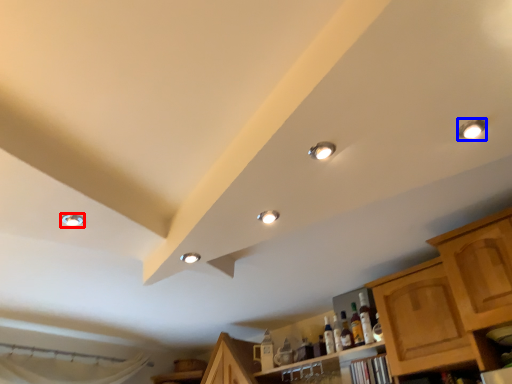
Question: Which of the following is the closest to the observer, droplight (highlighted by a red box) or droplight (highlighted by a blue box)?

Choices:
 (A) droplight
 (B) droplight

Answer: (B)